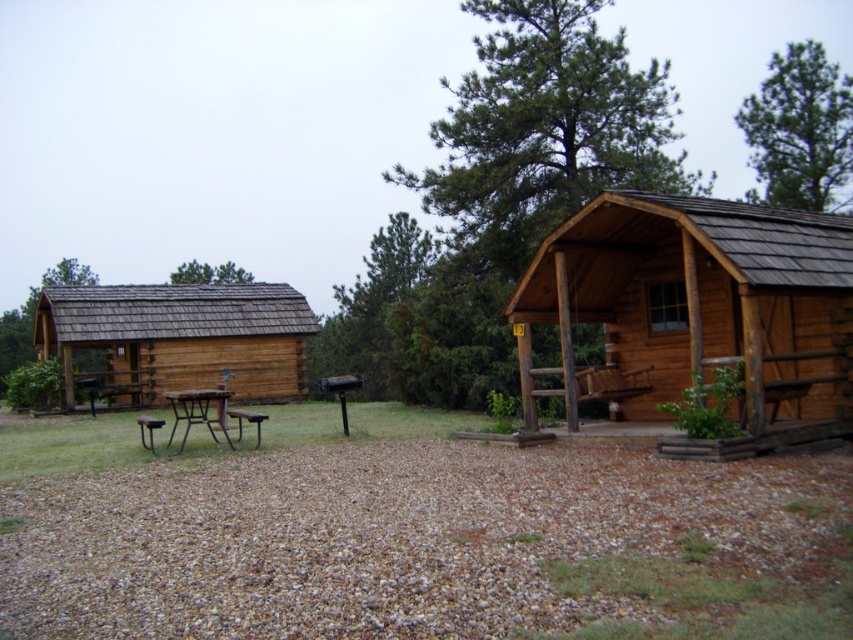
Question: Which point is closer to the camera?

Choices:
 (A) brown wooden hut at left
 (B) green leafy tree at upper right

Answer: (B)

Question: Estimate the real-world distances between objects in this image. Which object is closer to the brown wooden cabin at right?

Choices:
 (A) green leafy tree at upper right
 (B) brown gravel at center
 (C) brown wooden hut at left

Answer: (B)

Question: Which point is closer to the camera taking this photo?

Choices:
 (A) (347, 310)
 (B) (637, 88)
 (C) (781, 104)

Answer: (B)

Question: Does green textured tree at center have a lesser width compared to brown shingled roof at left?

Choices:
 (A) yes
 (B) no

Answer: (A)

Question: Observing the image, what is the correct spatial positioning of brown wooden hut at left in reference to green textured tree at center?

Choices:
 (A) right
 (B) left

Answer: (B)

Question: Is brown wooden hut at left wider than brown wooden picnic table at center?

Choices:
 (A) no
 (B) yes

Answer: (B)